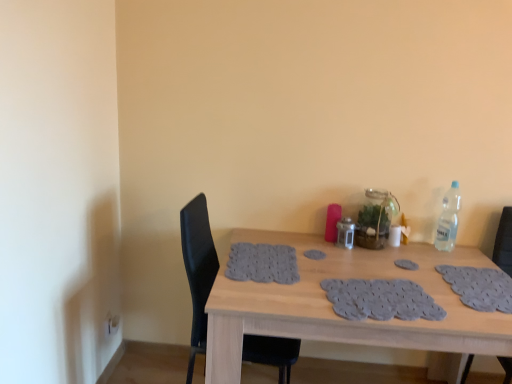
Question: Considering the relative sizes of wooden table at center and black leather chair at right, which is the first chair in right-to-left order, in the image provided, is wooden table at center shorter than black leather chair at right, which is the first chair in right-to-left order,?

Choices:
 (A) no
 (B) yes

Answer: (B)

Question: Can we say wooden table at center lies outside black leather chair at right, which is the first chair in right-to-left order?

Choices:
 (A) no
 (B) yes

Answer: (B)

Question: Can you confirm if wooden table at center is positioned to the right of black leather chair at right, which is counted as the 2th chair, starting from the left?

Choices:
 (A) no
 (B) yes

Answer: (A)

Question: From a real-world perspective, is wooden table at center physically above black leather chair at right, which is the first chair in right-to-left order?

Choices:
 (A) no
 (B) yes

Answer: (A)

Question: Is wooden table at center smaller than black leather chair at right, which is counted as the 2th chair, starting from the left?

Choices:
 (A) yes
 (B) no

Answer: (B)

Question: From a real-world perspective, relative to wooden table at center, is black leather chair at right, which is counted as the 2th chair, starting from the left, vertically above or below?

Choices:
 (A) below
 (B) above

Answer: (B)

Question: In terms of width, does black leather chair at right, which is the first chair in right-to-left order, look wider or thinner when compared to wooden table at center?

Choices:
 (A) thin
 (B) wide

Answer: (A)

Question: Is black leather chair at right, which is the first chair in right-to-left order, bigger or smaller than wooden table at center?

Choices:
 (A) small
 (B) big

Answer: (A)

Question: From the image's perspective, is black leather chair at right, which is counted as the 2th chair, starting from the left, above or below wooden table at center?

Choices:
 (A) below
 (B) above

Answer: (B)

Question: Visually, is clear plastic bottle at upper right positioned to the left or to the right of black leather chair at left, which is the second chair in right-to-left order?

Choices:
 (A) right
 (B) left

Answer: (A)

Question: Based on their sizes in the image, would you say clear plastic bottle at upper right is bigger or smaller than black leather chair at left, which is the second chair in right-to-left order?

Choices:
 (A) small
 (B) big

Answer: (A)

Question: Which is correct: clear plastic bottle at upper right is inside black leather chair at left, which is the second chair in right-to-left order, or outside of it?

Choices:
 (A) inside
 (B) outside

Answer: (B)

Question: From a real-world perspective, is clear plastic bottle at upper right physically located above or below black leather chair at left, which is counted as the first chair, starting from the left?

Choices:
 (A) below
 (B) above

Answer: (B)

Question: From a real-world perspective, is gray fabric placemat at center, the second footprint viewed from the top, positioned above or below gray fabric footprint at center, placed as the 1th footprint when sorted from left to right?

Choices:
 (A) below
 (B) above

Answer: (B)

Question: Considering the relative positions of gray fabric placemat at center, placed as the second footprint when sorted from left to right, and gray fabric footprint at center, placed as the 1th footprint when sorted from left to right, in the image provided, is gray fabric placemat at center, placed as the second footprint when sorted from left to right, to the left or to the right of gray fabric footprint at center, placed as the 1th footprint when sorted from left to right,?

Choices:
 (A) right
 (B) left

Answer: (A)